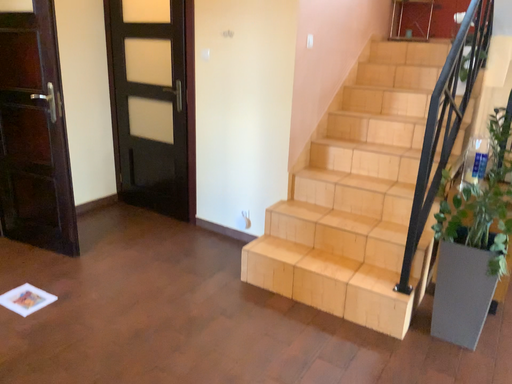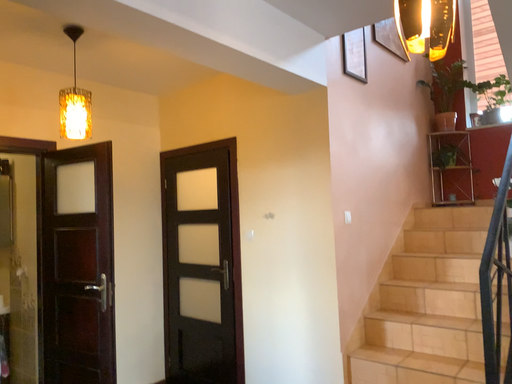
Question: How did the camera likely rotate when shooting the video?

Choices:
 (A) rotated upward
 (B) rotated downward

Answer: (A)